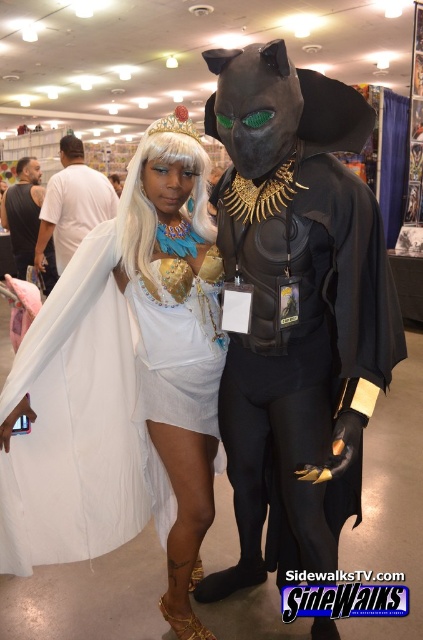
Is point (46, 240) farther from camera compared to point (30, 221)?

No, (46, 240) is closer to viewer.

Is the position of white fabric at left less distant than that of black matte t-shirt at left?

That is True.

At what (x,y) coordinates should I click in order to perform the action: click on white fabric at left. Please return your answer as a coordinate pair (x, y). Image resolution: width=423 pixels, height=640 pixels. Looking at the image, I should click on (71, 204).

Who is positioned more to the right, white silky wig at center or black matte t-shirt at left?

From the viewer's perspective, white silky wig at center appears more on the right side.

Is white silky wig at center below black matte t-shirt at left?

Yes.

Does point (142, 259) come in front of point (40, 196)?

Yes.

Image resolution: width=423 pixels, height=640 pixels. I want to click on white silky wig at center, so click(153, 196).

Who is positioned more to the right, white satin dress at center or white silky wig at center?

From the viewer's perspective, white silky wig at center appears more on the right side.

Is point (134, 419) more distant than point (167, 148)?

That is True.

In order to click on white satin dress at center in this screenshot , I will do tap(126, 380).